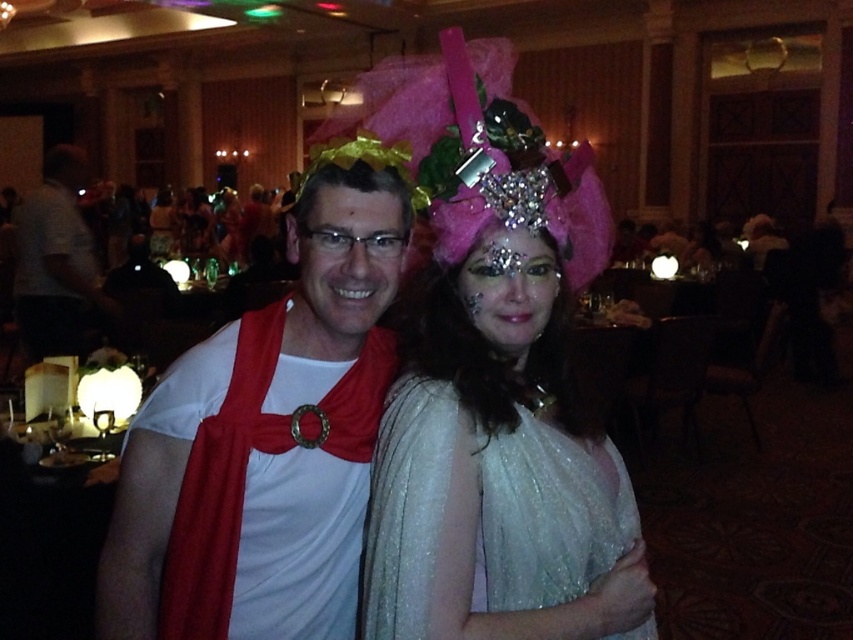
Question: Among these objects, which one is nearest to the camera?

Choices:
 (A) pink tulle headdress at center
 (B) white matte tunic at center
 (C) white matte toga at center

Answer: (C)

Question: Estimate the real-world distances between objects in this image. Which object is closer to the white matte tunic at center?

Choices:
 (A) white sequined dress at center
 (B) pink tulle headdress at center
 (C) white matte toga at center

Answer: (C)

Question: Is pink tulle headdress at center to the right of white matte tunic at center from the viewer's perspective?

Choices:
 (A) yes
 (B) no

Answer: (A)

Question: Is white sequined dress at center positioned behind white matte tunic at center?

Choices:
 (A) yes
 (B) no

Answer: (B)

Question: Considering the real-world distances, which object is farthest from the white sequined dress at center?

Choices:
 (A) white matte toga at center
 (B) white matte tunic at center
 (C) pink tulle headdress at center

Answer: (B)

Question: Is white matte toga at center to the right of pink tulle headdress at center from the viewer's perspective?

Choices:
 (A) yes
 (B) no

Answer: (B)